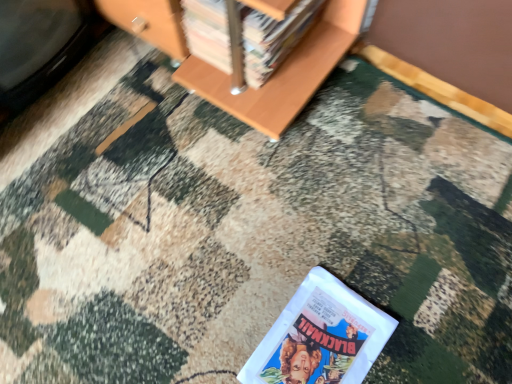
Question: Which direction should I rotate to face white glossy book at lower center, the first book positioned from the bottom, — up or down?

Choices:
 (A) up
 (B) down

Answer: (B)

Question: From the image's perspective, is white glossy book at lower center, the 2th book in the top-to-bottom sequence, located above wooden bookshelf at upper center, the first book when ordered from top to bottom?

Choices:
 (A) no
 (B) yes

Answer: (A)

Question: Is white glossy book at lower center, the first book positioned from the bottom, directly adjacent to wooden bookshelf at upper center, the first book when ordered from top to bottom?

Choices:
 (A) no
 (B) yes

Answer: (A)

Question: Is white glossy book at lower center, the first book positioned from the bottom, positioned with its back to wooden bookshelf at upper center, positioned as the second book in bottom-to-top order?

Choices:
 (A) yes
 (B) no

Answer: (B)

Question: Is white glossy book at lower center, the 2th book in the top-to-bottom sequence, not near wooden bookshelf at upper center, the first book when ordered from top to bottom?

Choices:
 (A) yes
 (B) no

Answer: (B)

Question: Considering the relative positions of white glossy book at lower center, the first book positioned from the bottom, and wooden bookshelf at upper center, the first book when ordered from top to bottom, in the image provided, is white glossy book at lower center, the first book positioned from the bottom, to the left of wooden bookshelf at upper center, the first book when ordered from top to bottom, from the viewer's perspective?

Choices:
 (A) no
 (B) yes

Answer: (A)

Question: Considering the relative sizes of white glossy book at lower center, the 2th book in the top-to-bottom sequence, and wooden bookshelf at upper center, positioned as the second book in bottom-to-top order, in the image provided, is white glossy book at lower center, the 2th book in the top-to-bottom sequence, shorter than wooden bookshelf at upper center, positioned as the second book in bottom-to-top order,?

Choices:
 (A) yes
 (B) no

Answer: (A)

Question: Is wooden bookshelf at upper center, positioned as the second book in bottom-to-top order, shorter than white glossy book at lower center, the first book positioned from the bottom?

Choices:
 (A) no
 (B) yes

Answer: (A)

Question: Is wooden bookshelf at upper center, positioned as the second book in bottom-to-top order, at the left side of white glossy book at lower center, the first book positioned from the bottom?

Choices:
 (A) no
 (B) yes

Answer: (B)

Question: Is wooden bookshelf at upper center, the first book when ordered from top to bottom, positioned with its back to white glossy book at lower center, the first book positioned from the bottom?

Choices:
 (A) no
 (B) yes

Answer: (A)

Question: Is wooden bookshelf at upper center, positioned as the second book in bottom-to-top order, further to the viewer compared to white glossy book at lower center, the first book positioned from the bottom?

Choices:
 (A) no
 (B) yes

Answer: (B)

Question: From the image's perspective, would you say wooden bookshelf at upper center, the first book when ordered from top to bottom, is positioned over white glossy book at lower center, the 2th book in the top-to-bottom sequence?

Choices:
 (A) yes
 (B) no

Answer: (A)

Question: Is wooden bookshelf at upper center, positioned as the second book in bottom-to-top order, bigger than white glossy book at lower center, the first book positioned from the bottom?

Choices:
 (A) no
 (B) yes

Answer: (B)

Question: From their relative heights in the image, would you say wooden bookshelf at upper center, positioned as the second book in bottom-to-top order, is taller or shorter than white glossy book at lower center, the first book positioned from the bottom?

Choices:
 (A) short
 (B) tall

Answer: (B)